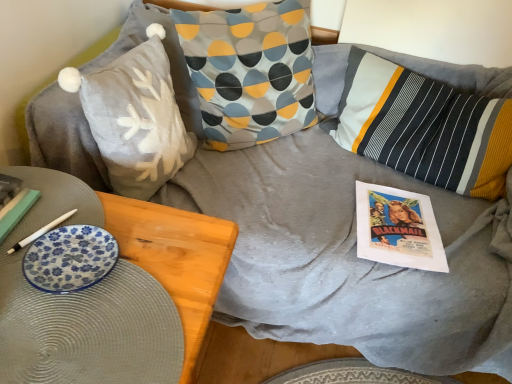
Where is `free area behind blue floral plate at lower left`? Image resolution: width=512 pixels, height=384 pixels. free area behind blue floral plate at lower left is located at coordinates (98, 207).